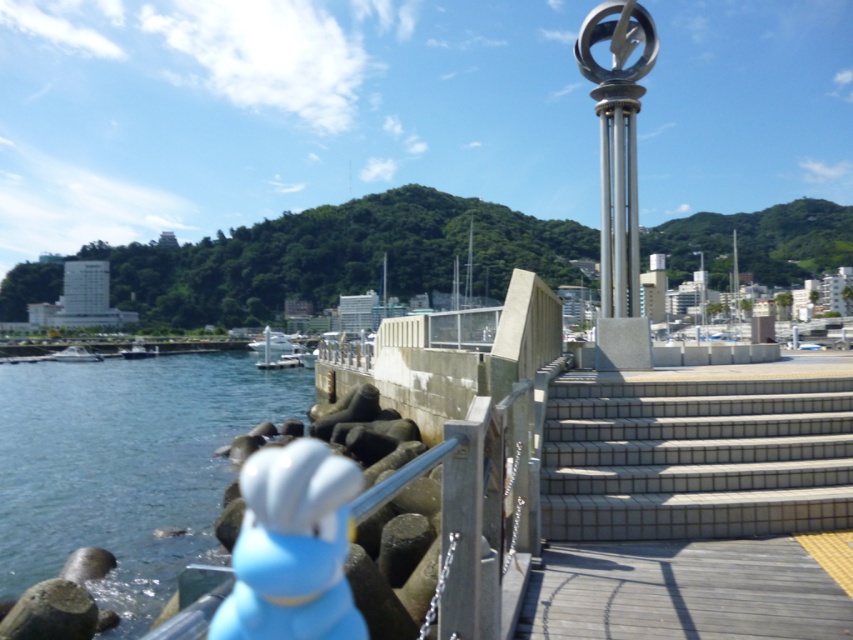
Can you confirm if white tile stairs at center is bigger than dark blue metallic boat at lower left?

No.

Is point (825, 458) closer to viewer compared to point (134, 356)?

Yes.

Locate an element on the screen. This screenshot has width=853, height=640. white tile stairs at center is located at coordinates (695, 458).

Can you confirm if white tile stairs at center is wider than polished silver pole at center-right?

Incorrect, white tile stairs at center's width does not surpass polished silver pole at center-right's.

Between white tile stairs at center and polished silver pole at center-right, which one is positioned lower?

Positioned lower is white tile stairs at center.

Which is in front, point (838, 493) or point (633, 276)?

Point (838, 493)

The width and height of the screenshot is (853, 640). In order to click on white tile stairs at center in this screenshot , I will do `click(695, 458)`.

Is blue water at lower left closer to the viewer compared to dark blue metallic boat at lower left?

A: Yes, blue water at lower left is closer to the viewer.

Measure the distance between blue water at lower left and camera.

blue water at lower left and camera are 7.92 meters apart from each other.

Find the location of a particular element. Image resolution: width=853 pixels, height=640 pixels. blue water at lower left is located at coordinates (125, 465).